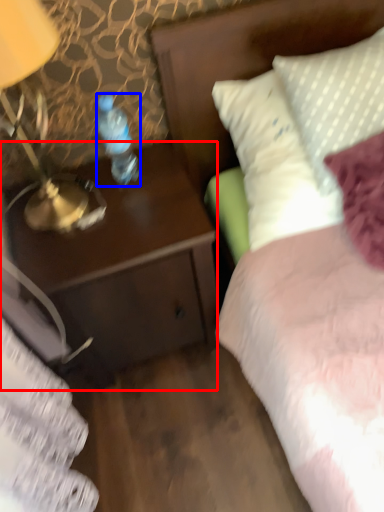
Question: Which object is further to the camera taking this photo, desk (highlighted by a red box) or bottle (highlighted by a blue box)?

Choices:
 (A) desk
 (B) bottle

Answer: (A)